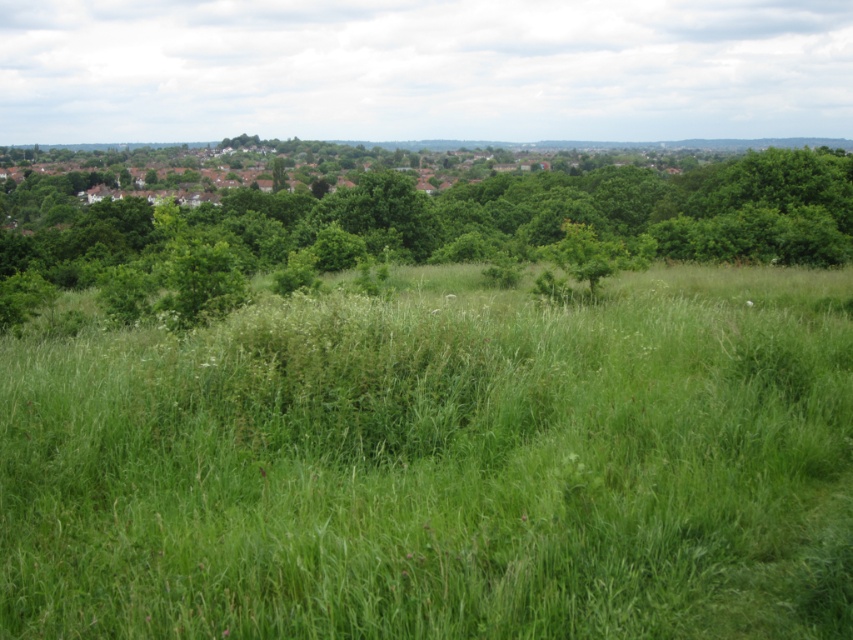
Question: Among these points, which one is nearest to the camera?

Choices:
 (A) (332, 609)
 (B) (734, 177)

Answer: (A)

Question: Does green grassy field at center appear on the left side of green leafy tree at upper center?

Choices:
 (A) yes
 (B) no

Answer: (B)

Question: Which object is closer to the camera taking this photo?

Choices:
 (A) green leafy tree at upper center
 (B) green grassy field at center

Answer: (B)

Question: Among these points, which one is nearest to the camera?

Choices:
 (A) (733, 570)
 (B) (440, 212)

Answer: (A)

Question: Does green grassy field at center appear over green leafy tree at upper center?

Choices:
 (A) no
 (B) yes

Answer: (A)

Question: Is green grassy field at center positioned before green leafy tree at upper center?

Choices:
 (A) yes
 (B) no

Answer: (A)